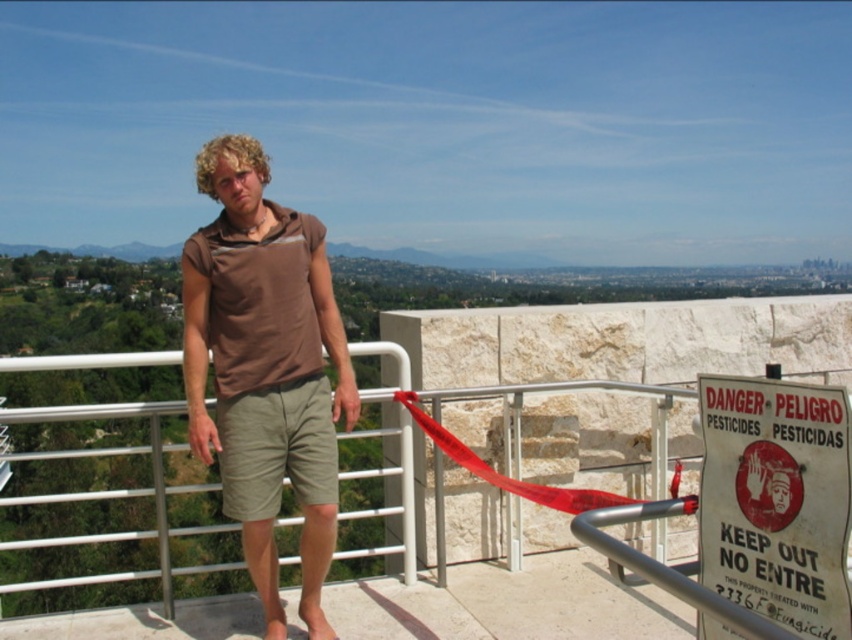
Question: Which point is farther to the camera?

Choices:
 (A) (614, 499)
 (B) (735, 492)

Answer: (A)

Question: Does brown cotton shirt at center appear under red fabric ribbon at center?

Choices:
 (A) yes
 (B) no

Answer: (B)

Question: Can you confirm if brown cotton shirt at center is positioned above red fabric ribbon at center?

Choices:
 (A) no
 (B) yes

Answer: (B)

Question: Observing the image, what is the correct spatial positioning of brown cotton shirt at center in reference to white paper sign at right?

Choices:
 (A) above
 (B) below

Answer: (A)

Question: Which of the following is the farthest from the observer?

Choices:
 (A) (446, 436)
 (B) (273, 406)

Answer: (A)

Question: Which point is farther to the camera?

Choices:
 (A) pyautogui.click(x=781, y=484)
 (B) pyautogui.click(x=490, y=472)

Answer: (B)